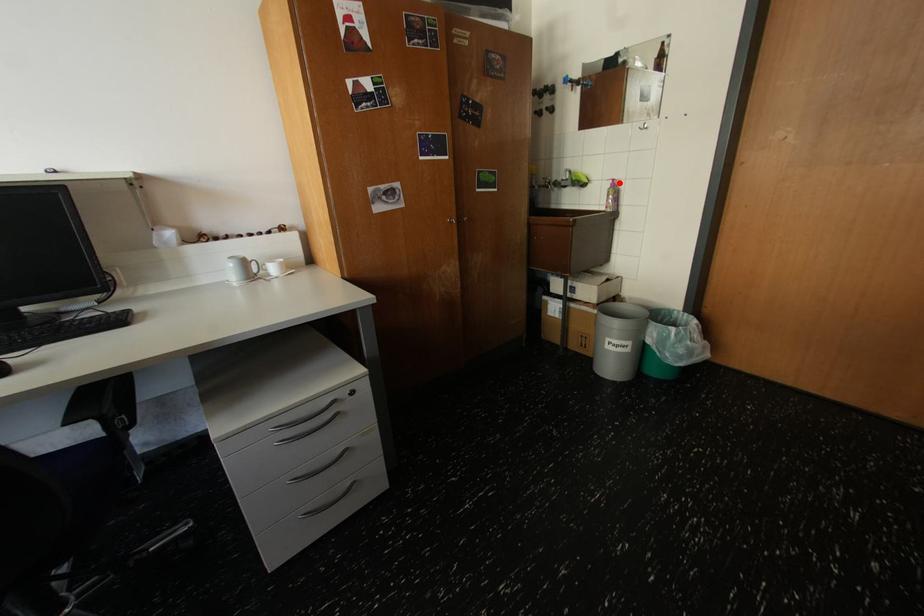
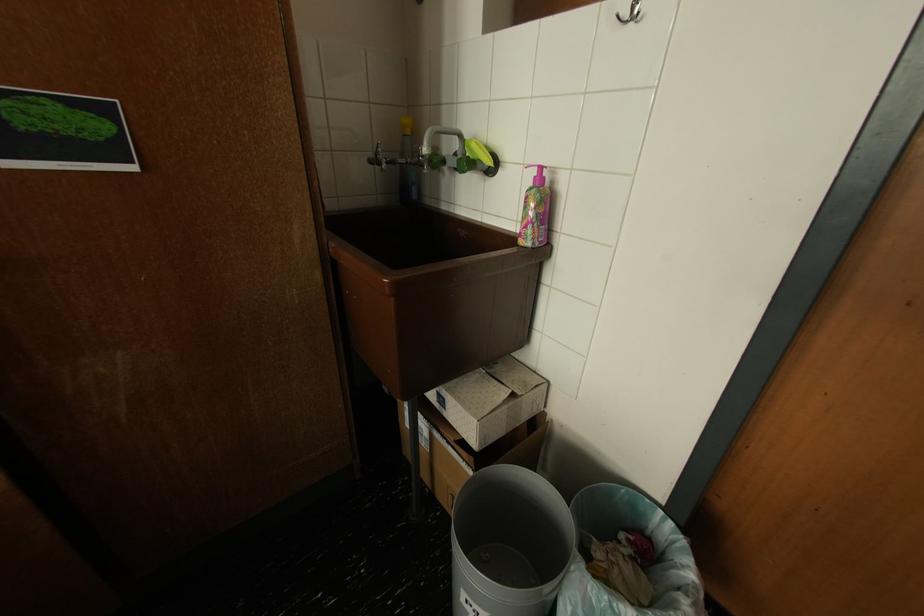
In the second image, find the point that corresponds to the highlighted location in the first image.

(542, 172)